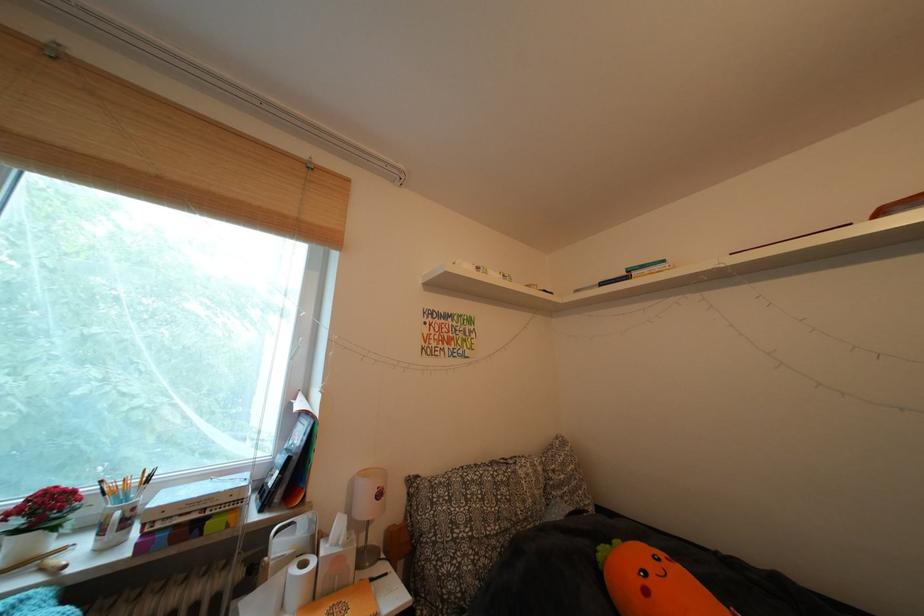
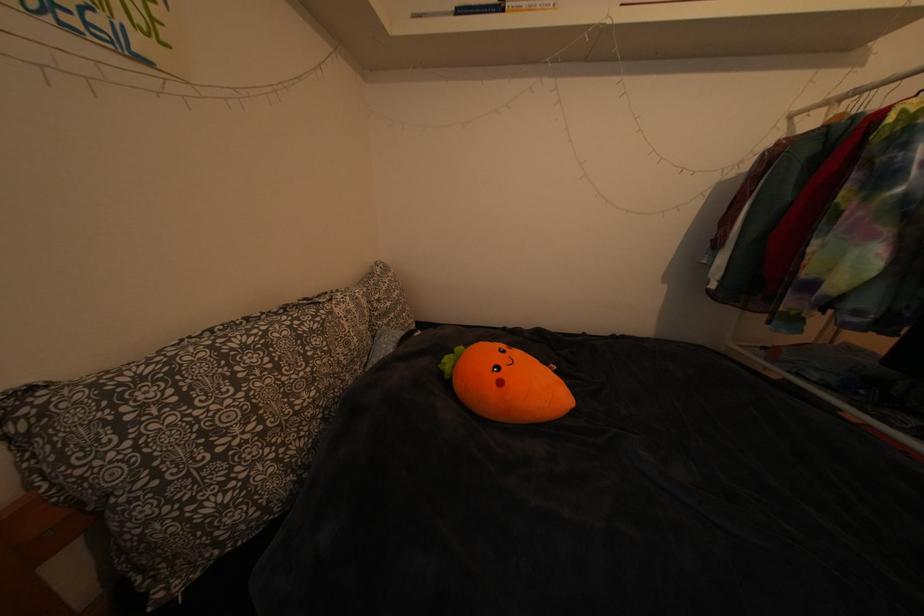
Where in the second image is the point corresponding to pixel 538 480 from the first image?

(359, 317)